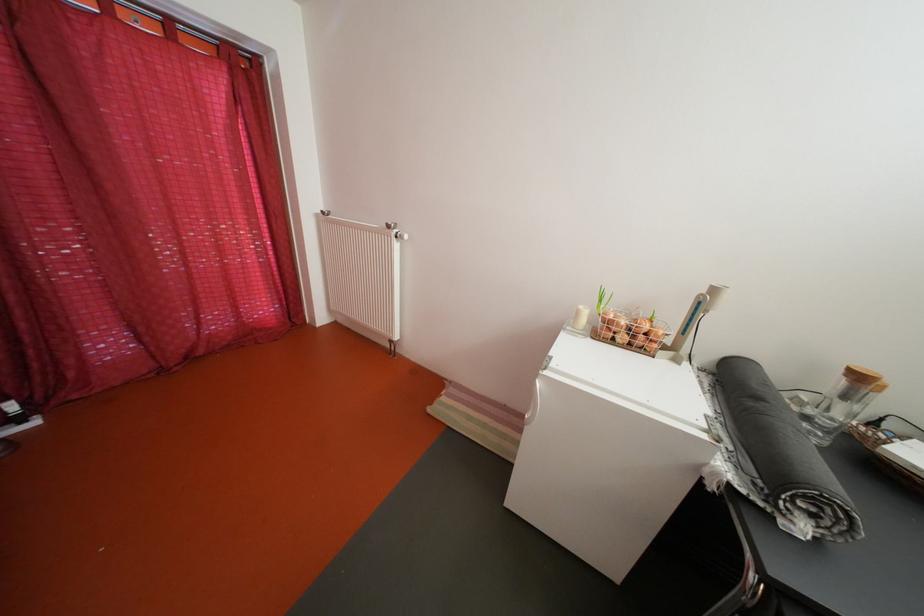
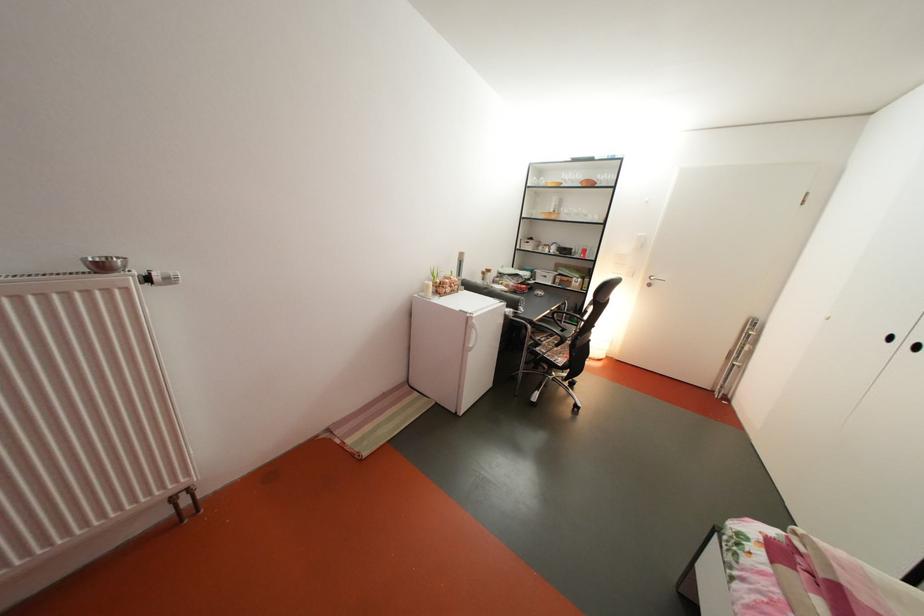
Find the pixel in the second image that matches pixel 589 318 in the first image.

(439, 293)